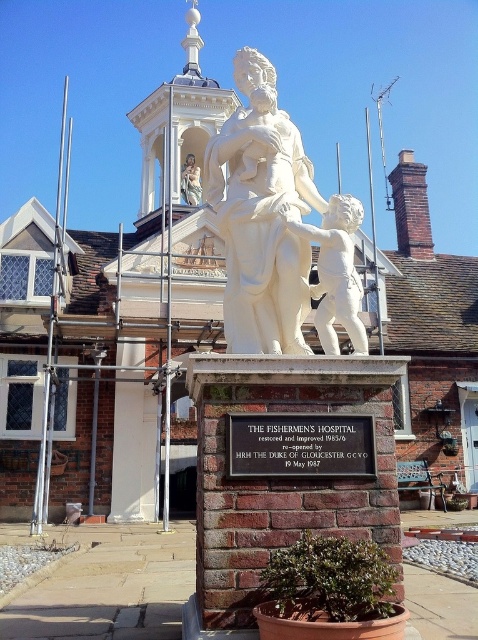
Question: Can you confirm if white marble statue at center is thinner than smooth marble statue at center?

Choices:
 (A) yes
 (B) no

Answer: (B)

Question: Which of the following is the farthest from the observer?

Choices:
 (A) (217, 132)
 (B) (184, 173)
 (C) (278, 428)

Answer: (A)

Question: Which of the following is the closest to the observer?

Choices:
 (A) (195, 179)
 (B) (253, 68)
 (C) (267, 474)

Answer: (C)

Question: Which object is positioned closest to the white marble statue at center?

Choices:
 (A) black stone plaque at center
 (B) white marble cherub at center
 (C) smooth marble statue at center

Answer: (B)

Question: Does black stone plaque at center appear under smooth marble statue at center?

Choices:
 (A) no
 (B) yes

Answer: (B)

Question: Is white marble cherub at center below smooth marble statue at center?

Choices:
 (A) no
 (B) yes

Answer: (B)